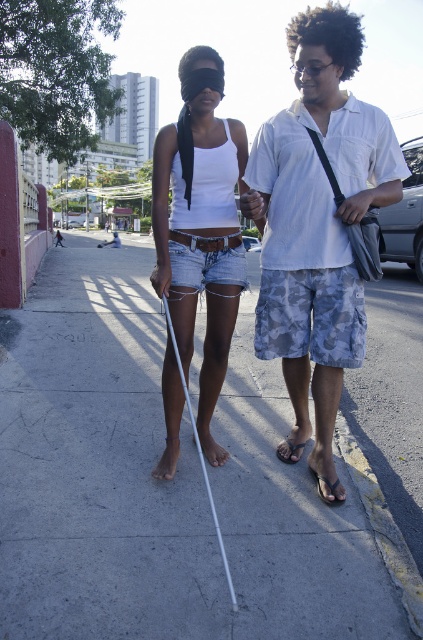
Based on the photo, you are a photographer standing in front of the scene. You want to take a closeup photo of the white cotton shirt at center. The camera you are using has a minimum focusing distance of 2 meters. Can you take the photo without moving closer?

The white cotton shirt at center is 2.50 meters away from the camera, which is beyond the minimum focusing distance of 2 meters. Therefore, you can take the closeup photo without moving closer.

You are a delivery person who needs to place a package at point A and point B. The coordinates for point A are point (40, 493) and point B are point (332, 502). Which point is closer to you?

Point A is closer to you because it is further to the viewer than point B.